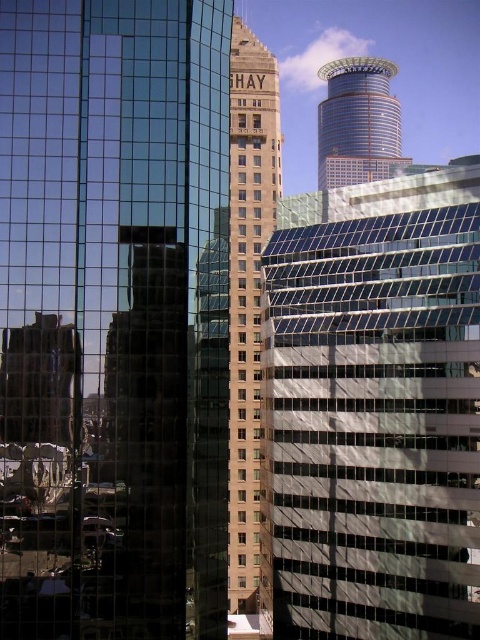
You are a city planner reviewing this urban layout. You need to determine the spatial relationship between the beige stone building at center and the shiny glass tower at upper center. Which one is positioned to the left?

The beige stone building at center is positioned to the left of the shiny glass tower at upper center according to the description.

You are standing at the point marked by the coordinates point (117,307) in the image. Looking around, you see the reflective glass skyscraper at left. Which direction should you face to see the reflective glass skyscraper at left?

The reflective glass skyscraper at left is located to your left side, so you should turn your body to face the left direction to see it.